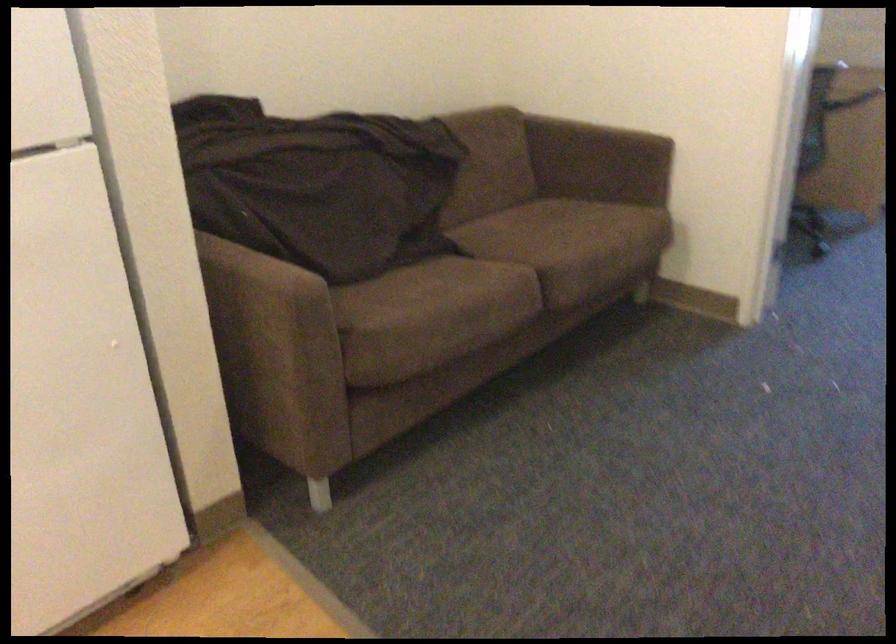
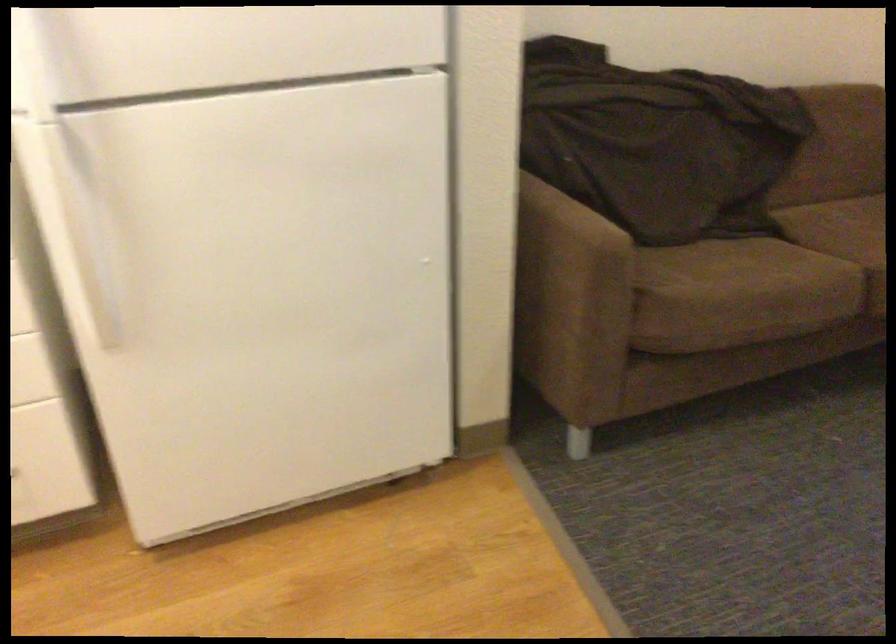
Question: How did the camera likely rotate?

Choices:
 (A) Left
 (B) Right
 (C) Up
 (D) Down

Answer: (A)